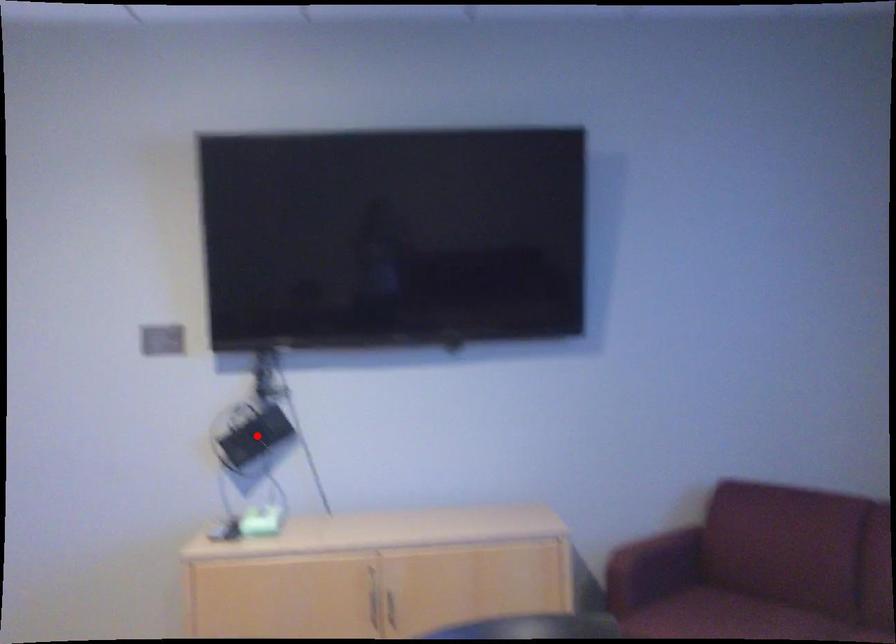
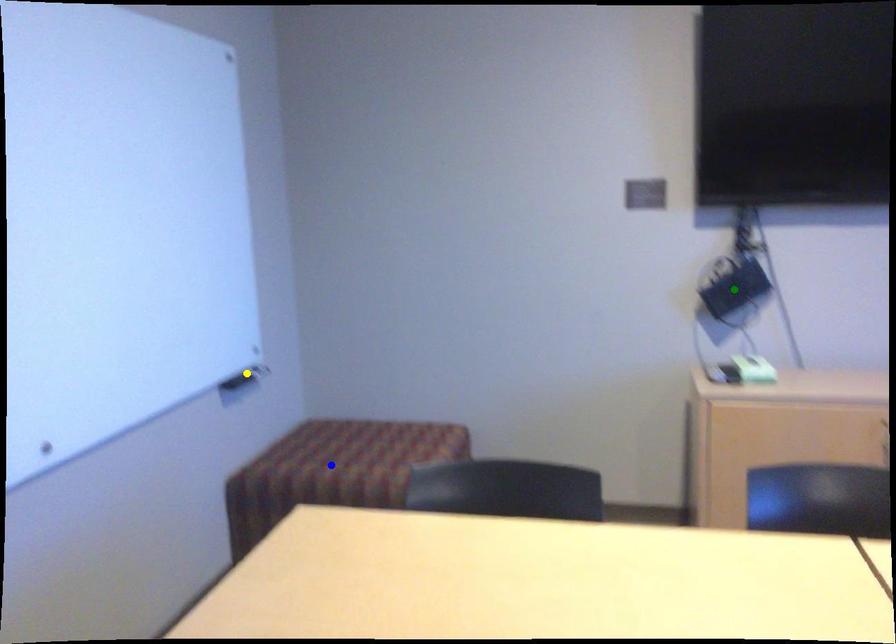
Question: I am providing you with two images of the same scene from different viewpoints. A red point is marked on the first image. You are given multiple points on the second image. Which point in image 2 represents the same 3d spot as the red point in image 1?

Choices:
 (A) yellow point
 (B) blue point
 (C) green point

Answer: (C)